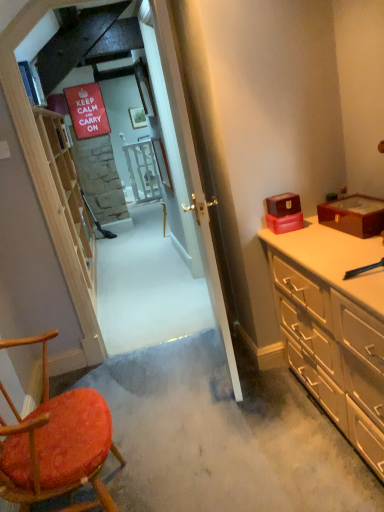
Question: Is wooden textured chair at lower left facing towards beige wood dresser at right?

Choices:
 (A) no
 (B) yes

Answer: (B)

Question: Is wooden textured chair at lower left behind beige wood dresser at right?

Choices:
 (A) yes
 (B) no

Answer: (B)

Question: Is wooden textured chair at lower left wider than beige wood dresser at right?

Choices:
 (A) no
 (B) yes

Answer: (A)

Question: Does wooden textured chair at lower left appear on the left side of beige wood dresser at right?

Choices:
 (A) yes
 (B) no

Answer: (A)

Question: Does wooden textured chair at lower left have a greater height compared to beige wood dresser at right?

Choices:
 (A) yes
 (B) no

Answer: (A)

Question: From a real-world perspective, is wooden textured chair at lower left located beneath beige wood dresser at right?

Choices:
 (A) yes
 (B) no

Answer: (B)

Question: Can you confirm if wooden textured chair at lower left is wider than shiny burgundy box at right, acting as the 1th box starting from the right?

Choices:
 (A) no
 (B) yes

Answer: (B)

Question: Is the position of wooden textured chair at lower left less distant than that of shiny burgundy box at right, which appears as the second box when viewed from the left?

Choices:
 (A) no
 (B) yes

Answer: (B)

Question: From a real-world perspective, is wooden textured chair at lower left below shiny burgundy box at right, which appears as the second box when viewed from the left?

Choices:
 (A) yes
 (B) no

Answer: (A)

Question: Considering the relative sizes of wooden textured chair at lower left and shiny burgundy box at right, which appears as the second box when viewed from the left, in the image provided, is wooden textured chair at lower left taller than shiny burgundy box at right, which appears as the second box when viewed from the left,?

Choices:
 (A) no
 (B) yes

Answer: (B)

Question: From the image's perspective, would you say wooden textured chair at lower left is positioned over shiny burgundy box at right, which appears as the second box when viewed from the left?

Choices:
 (A) no
 (B) yes

Answer: (A)

Question: Is wooden textured chair at lower left looking in the opposite direction of shiny burgundy box at right, acting as the 1th box starting from the right?

Choices:
 (A) yes
 (B) no

Answer: (B)

Question: Can you confirm if light wood shelf at left is taller than matte red box at right, the second box in the right-to-left sequence?

Choices:
 (A) yes
 (B) no

Answer: (A)